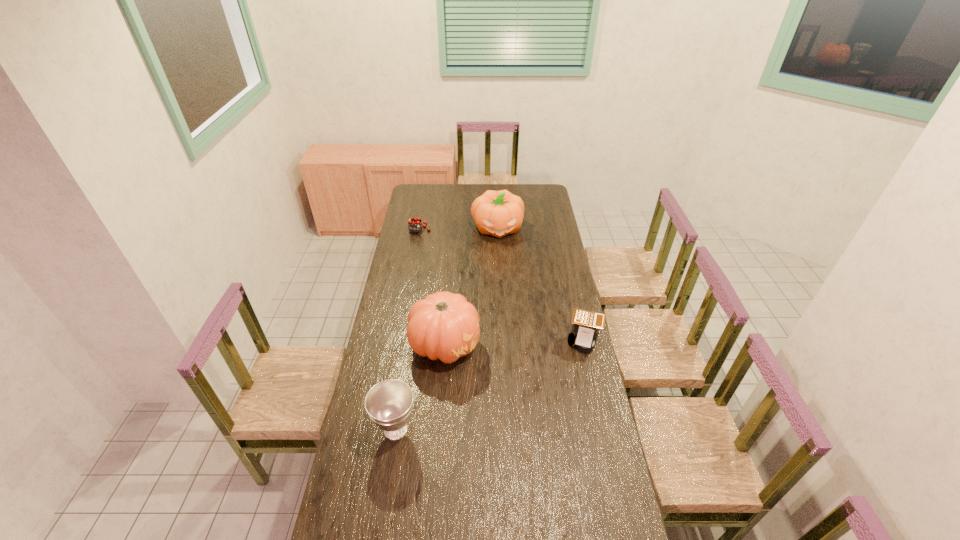
This screenshot has height=540, width=960. What are the coordinates of `vacant space situated on the handle side of the pot filled with cherries` in the screenshot? It's located at (448, 276).

The image size is (960, 540). Identify the location of vacant space located 0.210m on the carved face of the farther pumpkin. click(504, 267).

Find the location of a particular element. The width and height of the screenshot is (960, 540). free location located 0.260m on the carved face of the farther pumpkin is located at coordinates (504, 273).

The width and height of the screenshot is (960, 540). Find the location of `vacant space located 0.060m on the carved face of the farther pumpkin`. vacant space located 0.060m on the carved face of the farther pumpkin is located at coordinates (501, 250).

Locate an element on the screen. free spot located 0.380m on the carved face of the nearer pumpkin is located at coordinates (565, 380).

At what (x,y) coordinates should I click in order to perform the action: click on free space located 0.320m on the carved face of the nearer pumpkin. Please return your answer as a coordinate pair (x, y). Looking at the image, I should click on (551, 375).

You are a GUI agent. You are given a task and a screenshot of the screen. Output one action in this format:
    pyautogui.click(x=<x>, y=<y>)
    Task: Click on the free space located on the carved face of the nearer pumpkin
    The image size is (960, 540).
    Given the screenshot: What is the action you would take?
    pyautogui.click(x=553, y=376)

Find the location of a particular element. chalice that is at the left edge is located at coordinates (389, 403).

Where is `pot filled with cherries that is at the left edge`? The height and width of the screenshot is (540, 960). pot filled with cherries that is at the left edge is located at coordinates (414, 223).

Where is `pumpkin at the left edge`? pumpkin at the left edge is located at coordinates (444, 325).